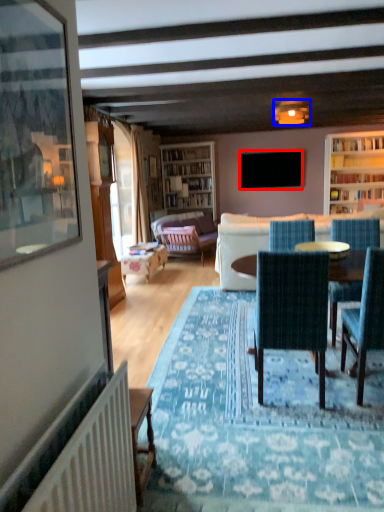
Question: Which object appears farthest to the camera in this image, television (highlighted by a red box) or lamp (highlighted by a blue box)?

Choices:
 (A) television
 (B) lamp

Answer: (A)